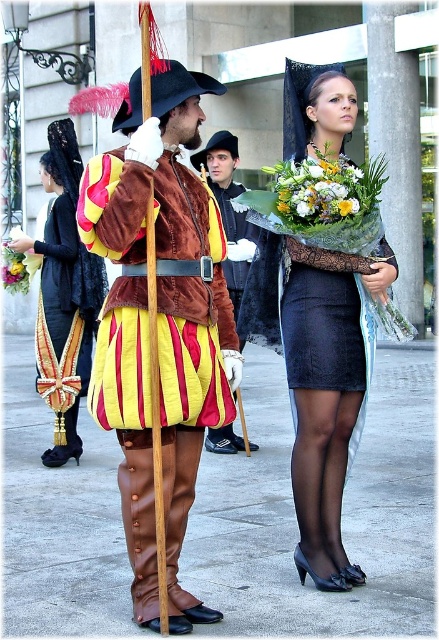
Which is behind, point (359, 188) or point (356, 204)?

Point (359, 188)

Which is more to the left, floral bouquet at center or white floral bouquet at center?

floral bouquet at center

This screenshot has height=640, width=439. What do you see at coordinates (316, 189) in the screenshot?
I see `floral bouquet at center` at bounding box center [316, 189].

Locate an element on the screen. The height and width of the screenshot is (640, 439). floral bouquet at center is located at coordinates (316, 189).

Does velvet brown coat at center appear on the right side of white floral bouquet at center?

In fact, velvet brown coat at center is to the left of white floral bouquet at center.

Is velvet brown coat at center below white floral bouquet at center?

Yes.

Locate an element on the screen. velvet brown coat at center is located at coordinates (159, 323).

The height and width of the screenshot is (640, 439). Find the location of `velvet brown coat at center`. velvet brown coat at center is located at coordinates (159, 323).

Can you confirm if matte black dress at center is positioned to the right of brown leather coat at center?

Correct, you'll find matte black dress at center to the right of brown leather coat at center.

Which is above, matte black dress at center or brown leather coat at center?

Positioned higher is brown leather coat at center.

I want to click on matte black dress at center, so click(x=319, y=376).